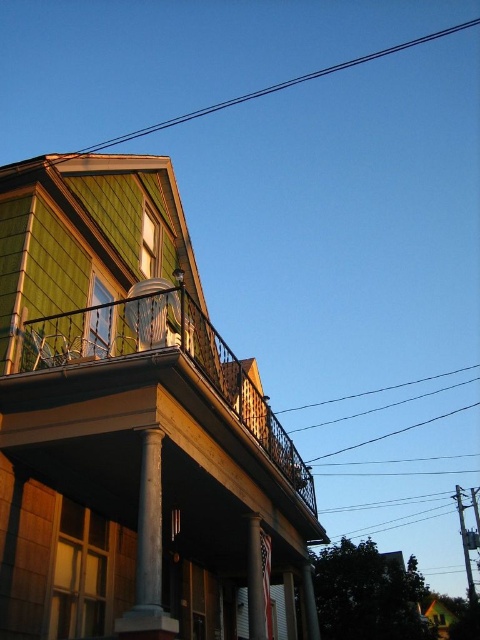
Question: Which of the following is the closest to the observer?

Choices:
 (A) wooden railing at upper center
 (B) white marble pillar at center

Answer: (A)

Question: Can you confirm if black wire at upper center is positioned below white marble pillar at center?

Choices:
 (A) yes
 (B) no

Answer: (B)

Question: Which object appears closest to the camera in this image?

Choices:
 (A) white marble pillar at center
 (B) white marble column at center
 (C) wooden railing at upper center
 (D) black wire at upper center

Answer: (B)

Question: Is wooden railing at upper center bigger than white marble pillar at center?

Choices:
 (A) yes
 (B) no

Answer: (A)

Question: Which of the following is the closest to the observer?

Choices:
 (A) white marble pillar at center
 (B) black wire at upper center
 (C) wooden railing at upper center
 (D) white marble column at center

Answer: (D)

Question: Is wooden railing at upper center wider than white marble column at center?

Choices:
 (A) no
 (B) yes

Answer: (B)